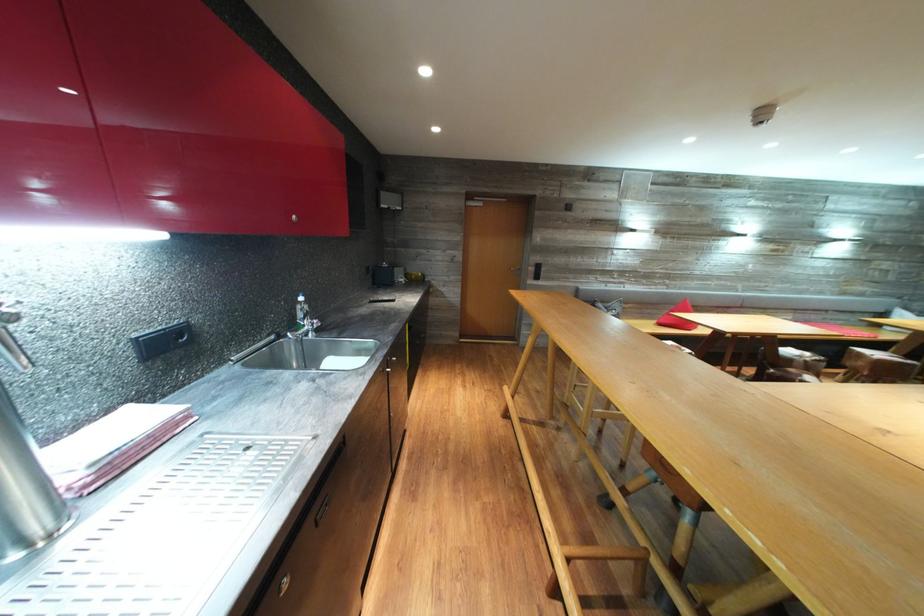
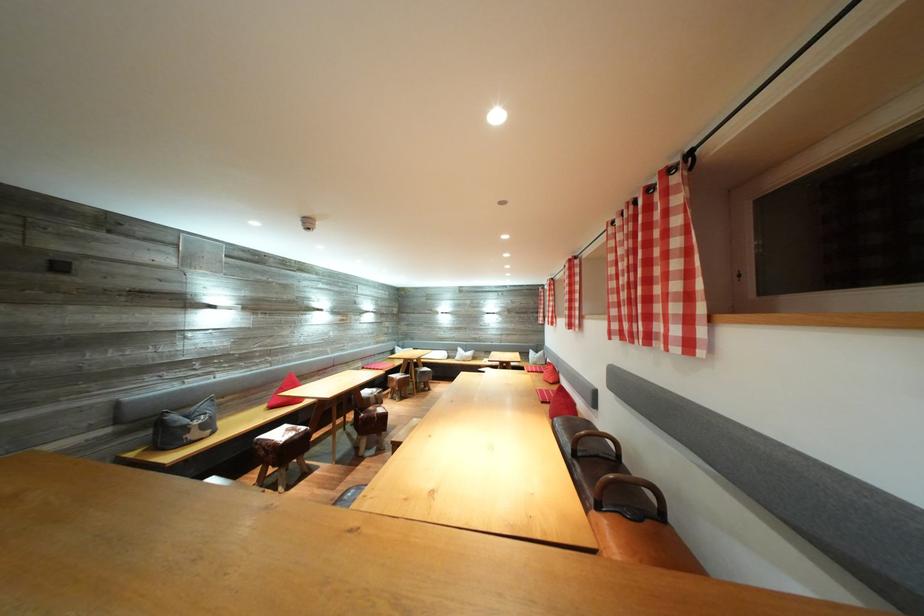
Locate, in the second image, the point that corresponds to (x=691, y=306) in the first image.

(298, 379)